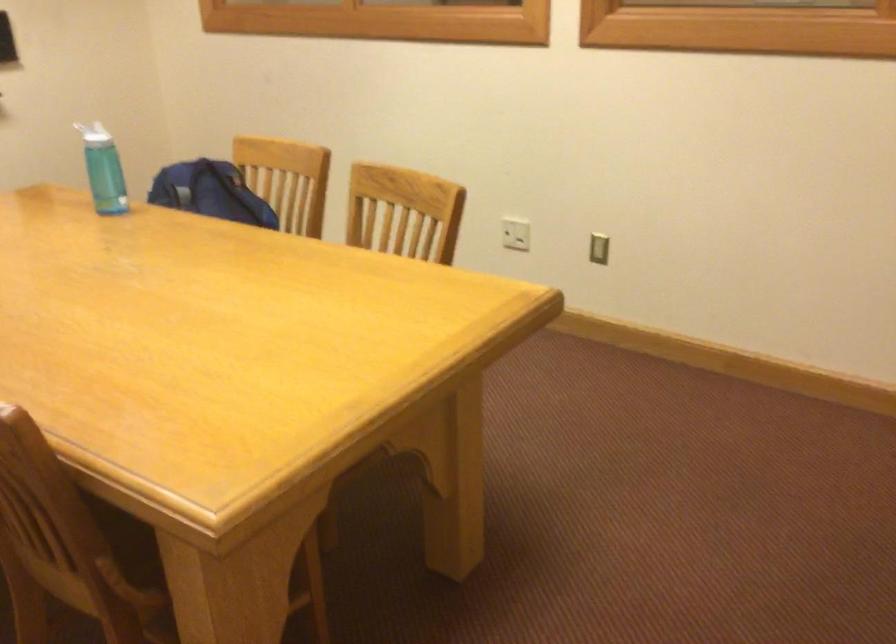
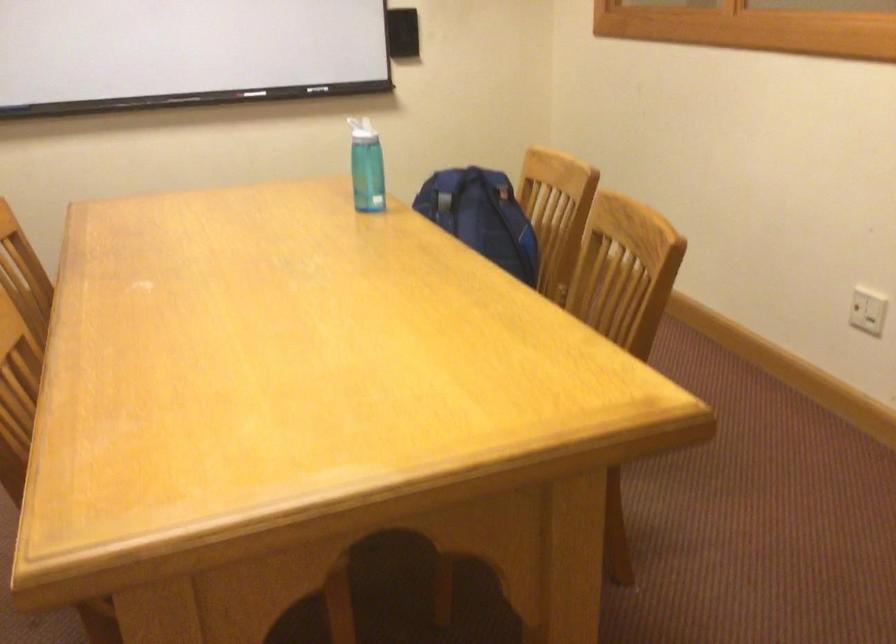
Question: The camera is either moving clockwise (left) or counter-clockwise (right) around the object. The first image is from the beginning of the video and the second image is from the end. Is the camera moving left or right when shooting the video?

Choices:
 (A) Left
 (B) Right

Answer: (B)